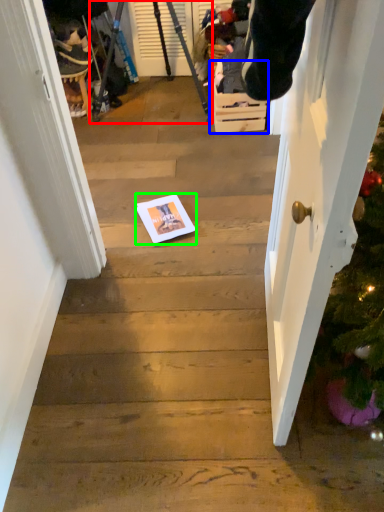
Question: Based on their relative distances, which object is nearer to tripod (highlighted by a red box)? Choose from drawer (highlighted by a blue box) and copy (highlighted by a green box).

Choices:
 (A) drawer
 (B) copy

Answer: (A)